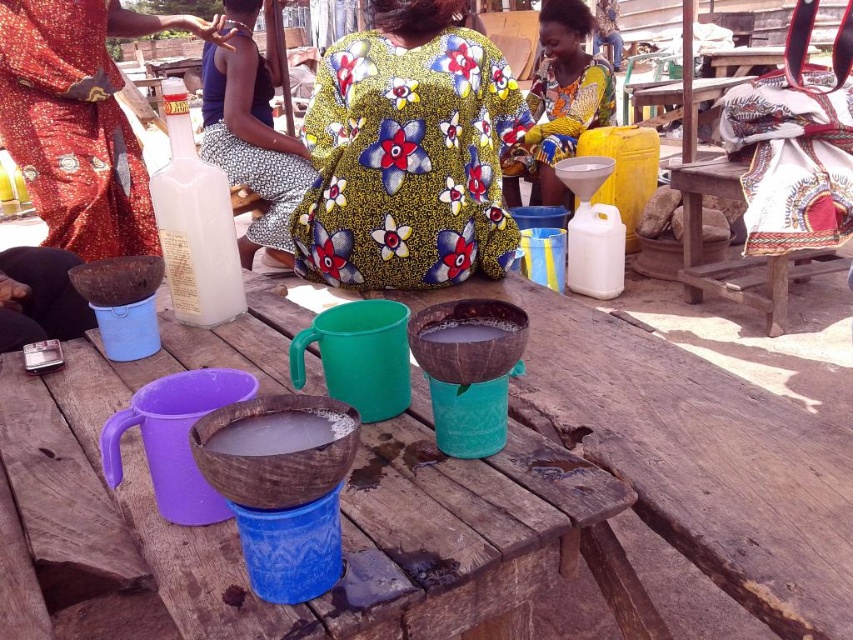
Question: Which of the following is the farthest from the observer?

Choices:
 (A) (403, 113)
 (B) (252, 40)
 (C) (583, 10)

Answer: (C)

Question: Can you confirm if printed fabric skirt at center is positioned below brown woven basket at center?

Choices:
 (A) yes
 (B) no

Answer: (B)

Question: Is wooden table at center further to camera compared to floral fabric dress at upper center?

Choices:
 (A) no
 (B) yes

Answer: (A)

Question: Can you confirm if wooden table at center is smaller than floral fabric dress at center?

Choices:
 (A) no
 (B) yes

Answer: (A)

Question: Among these points, which one is farthest from the camera?

Choices:
 (A) (238, 45)
 (B) (560, 26)
 (C) (257, 317)

Answer: (B)

Question: Which object appears farthest from the camera in this image?

Choices:
 (A) brown woven basket at center
 (B) brown matte bowl at center
 (C) floral fabric dress at upper center

Answer: (C)